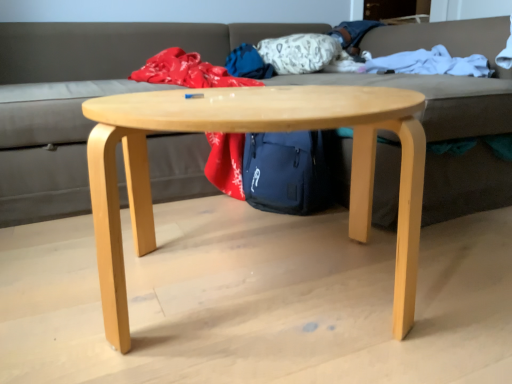
Find the location of a particular element. The width and height of the screenshot is (512, 384). free area below natural wood coffee table at center (from a real-world perspective) is located at coordinates (268, 302).